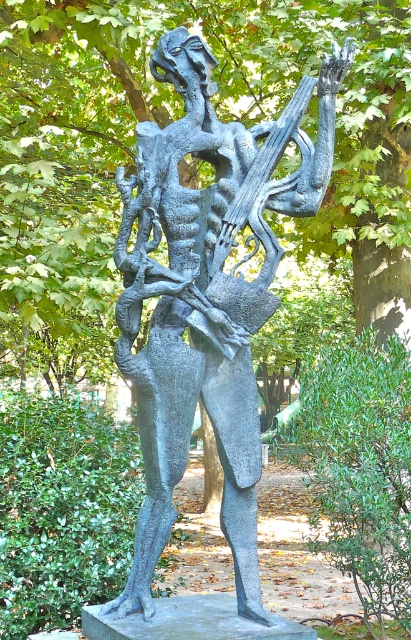
You are standing in front of the sculpture and want to take a photo of the green leafy tree at upper center. According to the coordinates provided, where should you aim your camera?

The green leafy tree at upper center is located at coordinates point (x=256, y=106), so you should aim your camera at that position to capture it.

You are standing in front of the sculpture and want to take a photo of the bronze textured sculpture at center without the green leafy tree at upper center appearing in the background. Is the tree behind or in front of the sculpture?

The green leafy tree at upper center is further to the viewer than the bronze textured sculpture at center, so the tree is in front of the sculpture. To avoid it in your photo, you need to adjust your angle or move so the tree is not behind the sculpture.

You are an artist planning to paint the scene from the image. You want to ensure the green leafy tree at upper center and the bronze textured sculpture at center are proportionally accurate. Which object should you paint larger in your artwork?

The green leafy tree at upper center should be painted larger than the bronze textured sculpture at center because it is bigger in the scene.